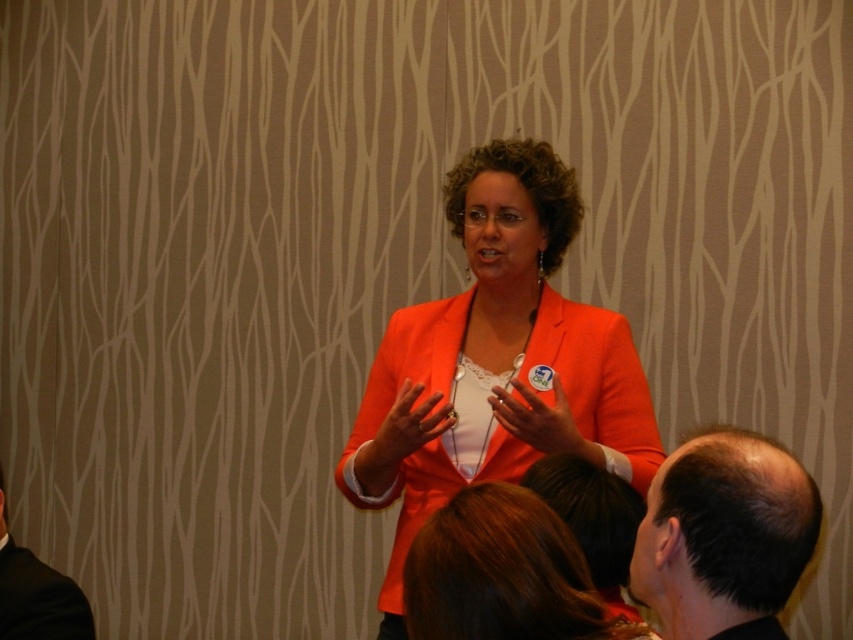
Question: Considering the relative positions of dark brown hair at lower right and black suit at lower left in the image provided, where is dark brown hair at lower right located with respect to black suit at lower left?

Choices:
 (A) below
 (B) above

Answer: (B)

Question: Which of the following is the farthest from the observer?

Choices:
 (A) shiny brown hair at lower center
 (B) orange matte blazer at center
 (C) black suit at lower left

Answer: (B)

Question: Which point is farther to the camera?

Choices:
 (A) black suit at lower left
 (B) orange matte blazer at center
 (C) dark brown hair at lower right

Answer: (B)

Question: Estimate the real-world distances between objects in this image. Which object is farther from the orange matte blazer at center?

Choices:
 (A) dark brown hair at lower right
 (B) black suit at lower left
 (C) orange matte jacket at center
 (D) shiny brown hair at lower center

Answer: (B)

Question: Does dark brown hair at lower right have a larger size compared to black suit at lower left?

Choices:
 (A) yes
 (B) no

Answer: (B)

Question: Is shiny brown hair at lower center positioned before orange matte jacket at center?

Choices:
 (A) yes
 (B) no

Answer: (A)